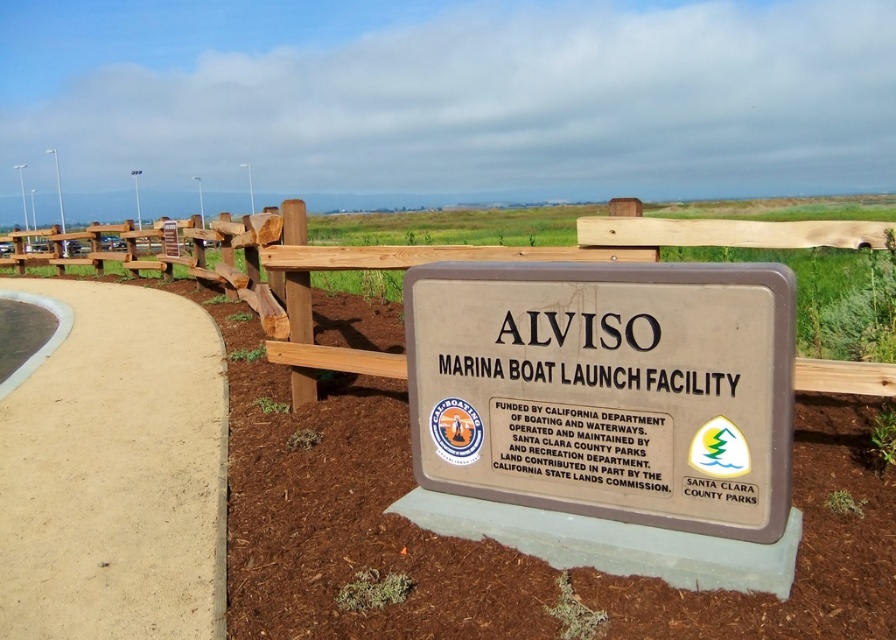
Question: Which object is positioned closest to the light tan concrete at lower left?

Choices:
 (A) brown wooden sign at center
 (B) brown polished wood sign at center

Answer: (B)

Question: Is the position of light tan concrete at lower left less distant than that of brown wooden sign at center?

Choices:
 (A) no
 (B) yes

Answer: (A)

Question: Which of the following is the closest to the observer?

Choices:
 (A) light tan concrete at lower left
 (B) brown wooden sign at center

Answer: (B)

Question: Where is brown polished wood sign at center located in relation to brown wooden sign at center in the image?

Choices:
 (A) below
 (B) above

Answer: (A)

Question: Among these points, which one is nearest to the camera?

Choices:
 (A) (455, 435)
 (B) (54, 544)

Answer: (A)

Question: From the image, what is the correct spatial relationship of brown polished wood sign at center in relation to brown wooden sign at center?

Choices:
 (A) right
 (B) left

Answer: (A)